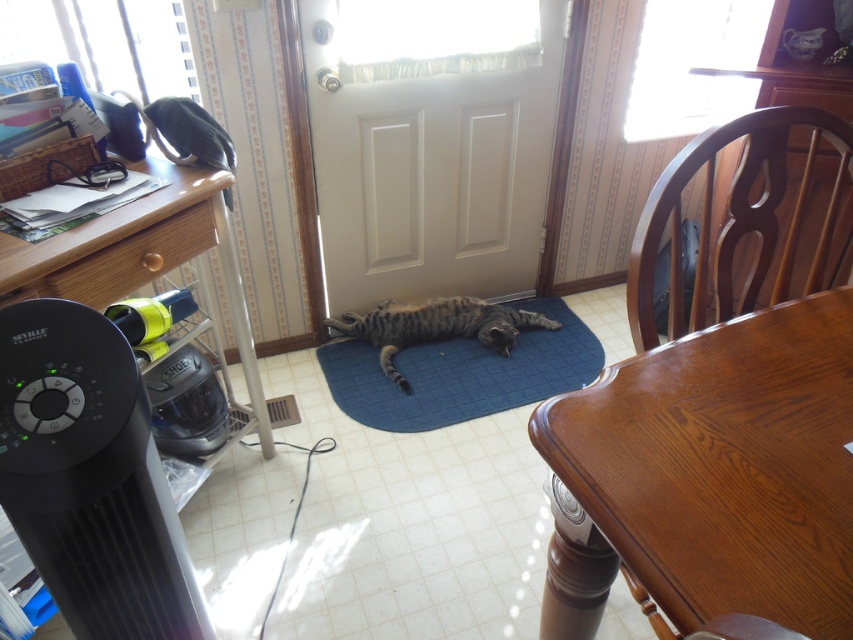
You are organizing a small dinner party and need to seat four guests. The black plastic table at left and brown wood chair at right are part of the setup. Can these two items accommodate all four guests comfortably?

The black plastic table at left is larger in size than the brown wood chair at right, but since there is only one brown wood chair at right mentioned, you would need additional chairs to seat four guests comfortably.

You are a delivery person who just arrived at the door. You need to place a small package on the wooden table near the brown wood chair at right. However, the tabby fur cat at center is lying on the blue mat. Can you reach the table without disturbing the cat?

The brown wood chair at right is 1.13 meters away from the tabby fur cat at center. Since the distance between them is relatively close, you can carefully navigate around the cat to reach the table without disturbing it.